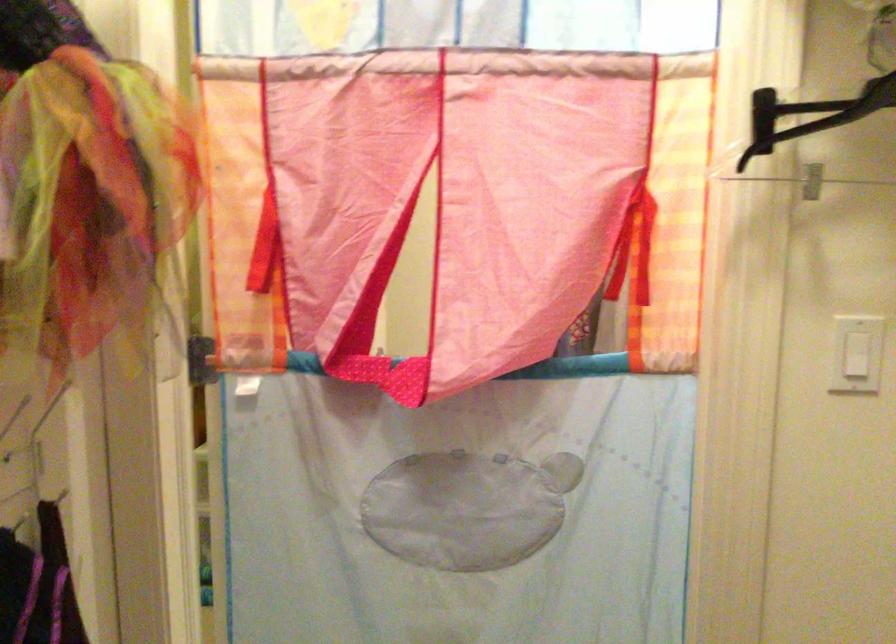
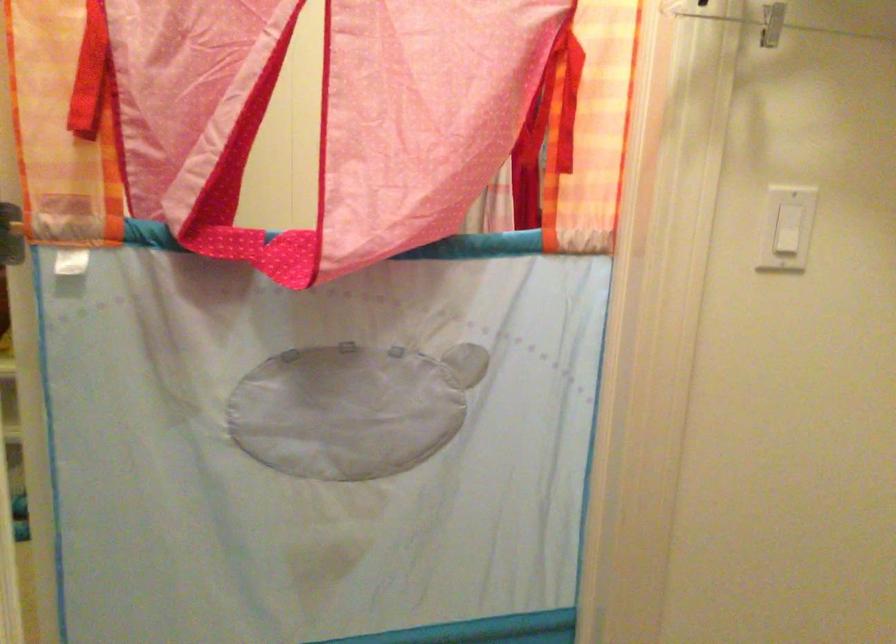
Where in the second image is the point corresponding to (x=464, y=509) from the first image?

(351, 408)